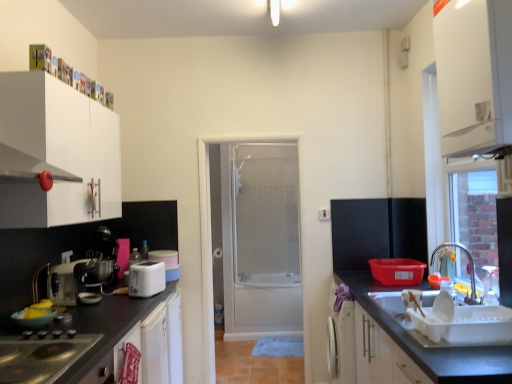
Question: Can you confirm if black glass gas stove at lower left is taller than metallic silver mixer at left, the 1th appliance from the front?

Choices:
 (A) yes
 (B) no

Answer: (B)

Question: Does black glass gas stove at lower left have a larger size compared to metallic silver mixer at left, the 1th appliance from the front?

Choices:
 (A) no
 (B) yes

Answer: (B)

Question: From a real-world perspective, is black glass gas stove at lower left located higher than metallic silver mixer at left, the 1th appliance from the front?

Choices:
 (A) yes
 (B) no

Answer: (B)

Question: Is black glass gas stove at lower left turned away from metallic silver mixer at left, the 1th appliance from the front?

Choices:
 (A) yes
 (B) no

Answer: (B)

Question: Is black glass gas stove at lower left positioned in front of metallic silver mixer at left, which is counted as the 3th appliance, starting from the back?

Choices:
 (A) no
 (B) yes

Answer: (B)

Question: Is metallic silver mixer at left, which is counted as the 3th appliance, starting from the back, spatially inside black glass gas stove at lower left, or outside of it?

Choices:
 (A) inside
 (B) outside

Answer: (B)

Question: In terms of width, does metallic silver mixer at left, the 1th appliance from the front, look wider or thinner when compared to black glass gas stove at lower left?

Choices:
 (A) thin
 (B) wide

Answer: (A)

Question: Is point pos(78,281) closer or farther from the camera than point pos(29,354)?

Choices:
 (A) farther
 (B) closer

Answer: (A)

Question: In the image, is metallic silver mixer at left, the 1th appliance from the front, positioned in front of or behind black glass gas stove at lower left?

Choices:
 (A) front
 (B) behind

Answer: (B)

Question: Is smooth black countertop at lower right bigger or smaller than black glass gas stove at lower left?

Choices:
 (A) small
 (B) big

Answer: (B)

Question: From a real-world perspective, is smooth black countertop at lower right physically located above or below black glass gas stove at lower left?

Choices:
 (A) below
 (B) above

Answer: (A)

Question: From the image's perspective, relative to black glass gas stove at lower left, is smooth black countertop at lower right above or below?

Choices:
 (A) below
 (B) above

Answer: (A)

Question: Is smooth black countertop at lower right in front of or behind black glass gas stove at lower left in the image?

Choices:
 (A) behind
 (B) front

Answer: (A)

Question: Do you think white matte cabinet at lower left, the 2th cabinetry positioned from the left, is within white matte cabinet at left, which appears as the first cabinetry when viewed from the left, or outside of it?

Choices:
 (A) inside
 (B) outside

Answer: (B)

Question: From the image's perspective, relative to white matte cabinet at left, which appears as the third cabinetry when viewed from the right, is white matte cabinet at lower left, marked as the 1th cabinetry in a bottom-to-top arrangement, above or below?

Choices:
 (A) above
 (B) below

Answer: (B)